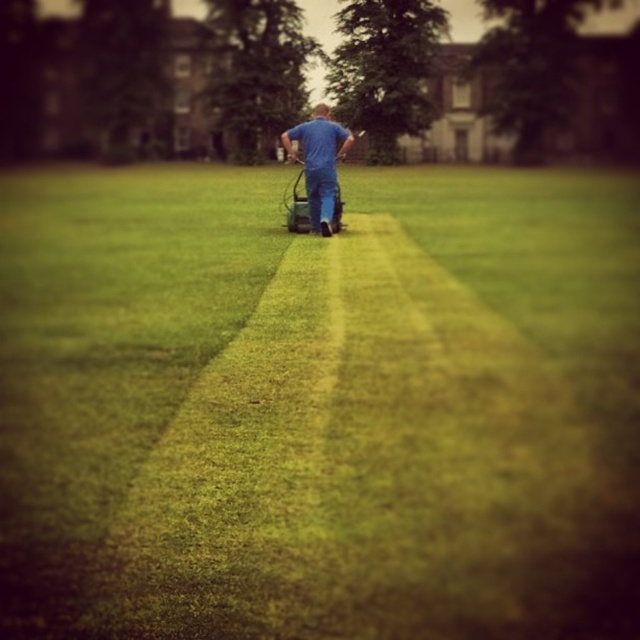
You are a gardener who wants to ensure the lawn is mowed to the correct height. According to the image, which object is taller between the green grass at center and the blue denim jeans at center?

The green grass at center is taller than the blue denim jeans at center.

You are standing at the origin point in the image. Which direction should you move to reach the green grass at center?

The green grass at center is located at point 0.636 on the x and 0.498 on the y axis, so you should move towards the right and slightly forward to reach it.

You are standing at the point labeled as point (317, 406) in the image. What object are you standing on?

You are standing on the green grass at center, as the point (317, 406) corresponds to that location.